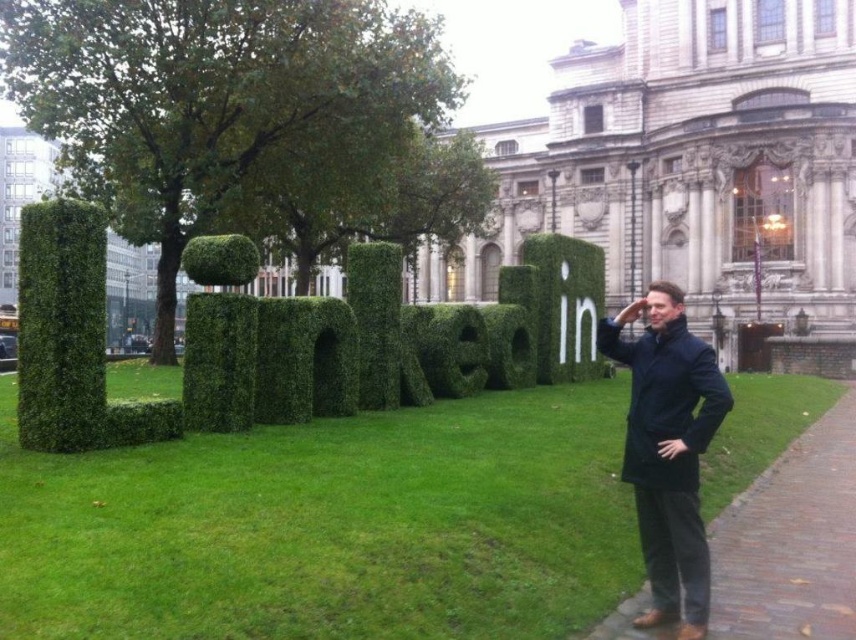
Does dark blue jacket at right have a greater height compared to white grass letter at center?

Correct, dark blue jacket at right is much taller as white grass letter at center.

Does dark blue jacket at right have a greater width compared to white grass letter at center?

Yes.

Who is more distant from viewer, (x=634, y=436) or (x=591, y=348)?

Positioned behind is point (x=591, y=348).

Locate an element on the screen. dark blue jacket at right is located at coordinates (669, 451).

Does green bushy hedge at center have a lesser height compared to dark blue jacket at right?

Correct, green bushy hedge at center is not as tall as dark blue jacket at right.

Measure the distance between green bushy hedge at center and camera.

They are 36.01 meters apart.

You are a GUI agent. You are given a task and a screenshot of the screen. Output one action in this format:
    pyautogui.click(x=<x>, y=<y>)
    Task: Click on the green bushy hedge at center
    
    Given the screenshot: What is the action you would take?
    point(384,340)

Who is positioned more to the right, green grass at center or green bushy hedge at center?

green grass at center

Can you confirm if green grass at center is thinner than green bushy hedge at center?

Incorrect, green grass at center's width is not less than green bushy hedge at center's.

The width and height of the screenshot is (856, 640). Describe the element at coordinates (330, 525) in the screenshot. I see `green grass at center` at that location.

Find the location of a particular element. green grass at center is located at coordinates (330, 525).